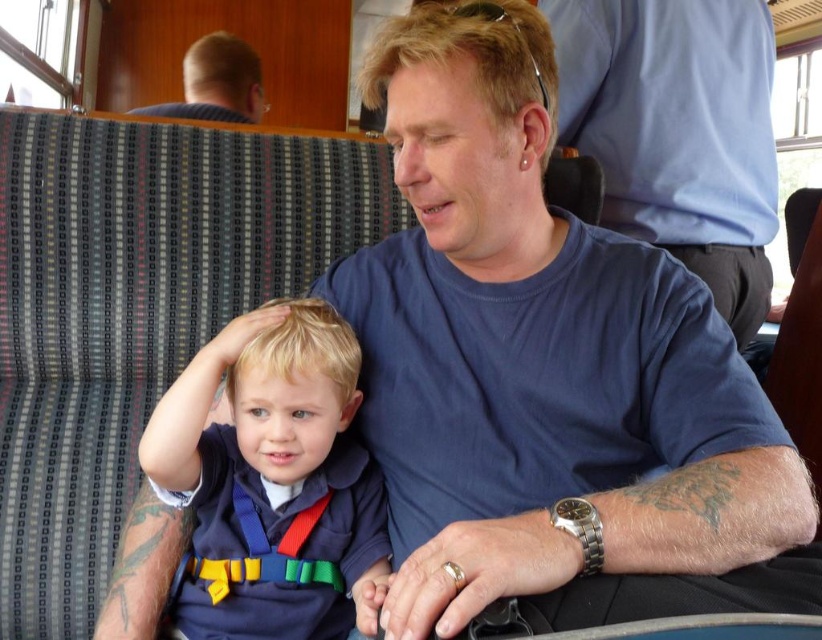
How far apart are blue cotton shirt at upper center and blonde hair at upper left?

1.11 meters

Find the location of a particular element. The width and height of the screenshot is (822, 640). blue cotton shirt at upper center is located at coordinates (677, 131).

Describe the element at coordinates (677, 131) in the screenshot. I see `blue cotton shirt at upper center` at that location.

You are a GUI agent. You are given a task and a screenshot of the screen. Output one action in this format:
    pyautogui.click(x=<x>, y=<y>)
    Task: Click on the blue cotton shirt at upper center
    This screenshot has width=822, height=640.
    Given the screenshot: What is the action you would take?
    pyautogui.click(x=677, y=131)

Is blue fabric shirt at center to the left of blue cotton shirt at upper center from the viewer's perspective?

Correct, you'll find blue fabric shirt at center to the left of blue cotton shirt at upper center.

Which is in front, point (312, 440) or point (767, 189)?

Point (312, 440) is more forward.

At what (x,y) coordinates should I click in order to perform the action: click on blue fabric shirt at center. Please return your answer as a coordinate pair (x, y). This screenshot has height=640, width=822. Looking at the image, I should click on (273, 477).

Is blue fabric shirt at center to the left of blonde hair at upper left from the viewer's perspective?

In fact, blue fabric shirt at center is to the right of blonde hair at upper left.

Is point (358, 464) positioned in front of point (225, 84)?

That is True.

Where is `blue fabric shirt at center`? blue fabric shirt at center is located at coordinates (273, 477).